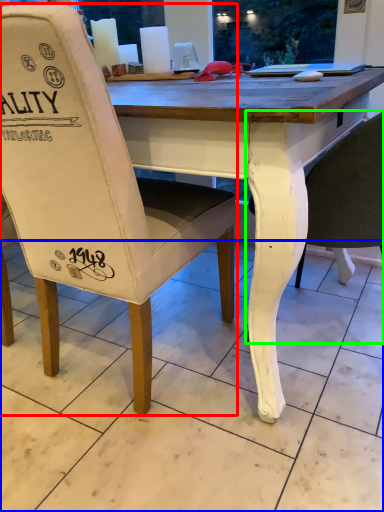
Question: Which object is the farthest from chair (highlighted by a red box)? Choose among these: tile (highlighted by a blue box) or chair (highlighted by a green box).

Choices:
 (A) tile
 (B) chair

Answer: (B)